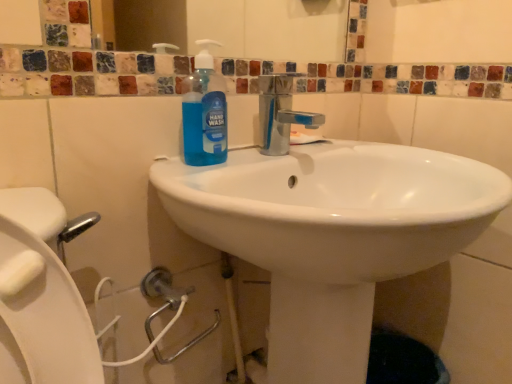
Question: Should I look upward or downward to see blue translucent hand wash at center?

Choices:
 (A) up
 (B) down

Answer: (A)

Question: Is white glossy sink at center thinner than blue translucent hand wash at center?

Choices:
 (A) yes
 (B) no

Answer: (B)

Question: Does white glossy sink at center have a larger size compared to blue translucent hand wash at center?

Choices:
 (A) yes
 (B) no

Answer: (A)

Question: From the image's perspective, is white glossy sink at center above blue translucent hand wash at center?

Choices:
 (A) no
 (B) yes

Answer: (A)

Question: From the image's perspective, does white glossy sink at center appear lower than blue translucent hand wash at center?

Choices:
 (A) no
 (B) yes

Answer: (B)

Question: Is white glossy sink at center taller than blue translucent hand wash at center?

Choices:
 (A) no
 (B) yes

Answer: (B)

Question: From a real-world perspective, is white glossy sink at center under blue translucent hand wash at center?

Choices:
 (A) no
 (B) yes

Answer: (B)

Question: Could you tell me if blue translucent hand wash at center is facing white glossy sink at center?

Choices:
 (A) no
 (B) yes

Answer: (B)

Question: Is blue translucent hand wash at center oriented away from white glossy sink at center?

Choices:
 (A) no
 (B) yes

Answer: (B)

Question: From the image's perspective, is blue translucent hand wash at center above white glossy sink at center?

Choices:
 (A) yes
 (B) no

Answer: (A)

Question: Considering the relative sizes of blue translucent hand wash at center and white glossy sink at center in the image provided, is blue translucent hand wash at center wider than white glossy sink at center?

Choices:
 (A) no
 (B) yes

Answer: (A)

Question: Considering the relative sizes of blue translucent hand wash at center and white glossy sink at center in the image provided, is blue translucent hand wash at center shorter than white glossy sink at center?

Choices:
 (A) no
 (B) yes

Answer: (B)

Question: Is blue translucent hand wash at center taller than white glossy sink at center?

Choices:
 (A) yes
 (B) no

Answer: (B)

Question: In terms of height, does blue translucent hand wash at center look taller or shorter compared to white glossy sink at center?

Choices:
 (A) tall
 (B) short

Answer: (B)